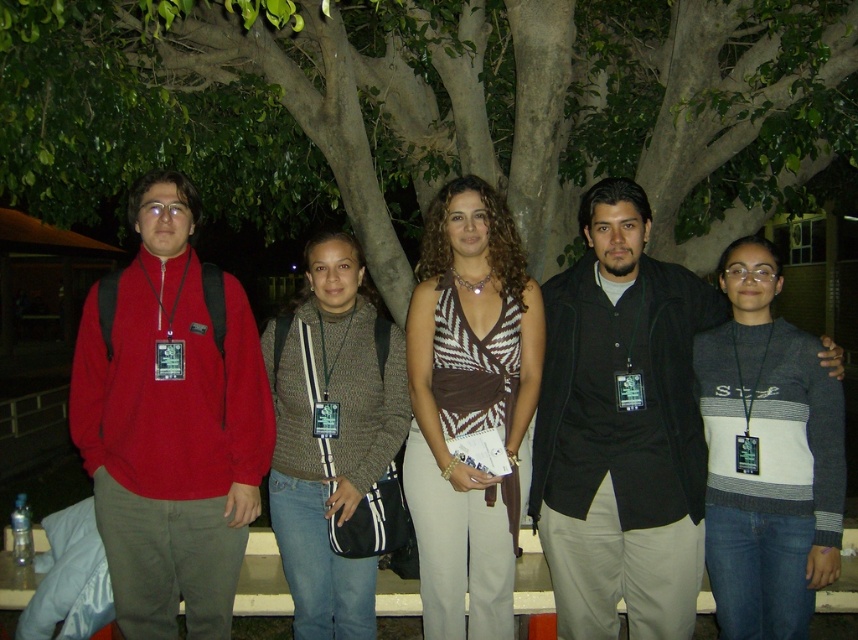
Question: Which of the following is the closest to the observer?

Choices:
 (A) (287, 26)
 (B) (322, 333)
 (C) (152, 371)

Answer: (C)

Question: Which object is positioned closest to the matte red sweater at left?

Choices:
 (A) green leafy tree at center
 (B) gray sweater at center

Answer: (A)

Question: Among these points, which one is farthest from the camera?

Choices:
 (A) (630, 349)
 (B) (764, 595)

Answer: (B)

Question: In this image, where is green leafy tree at center located relative to gray sweater at center?

Choices:
 (A) above
 (B) below

Answer: (A)

Question: Can you confirm if dark gray vest at center is smaller than gray sweater at center?

Choices:
 (A) no
 (B) yes

Answer: (A)

Question: Is dark gray vest at center wider than brown textured top at center?

Choices:
 (A) yes
 (B) no

Answer: (A)